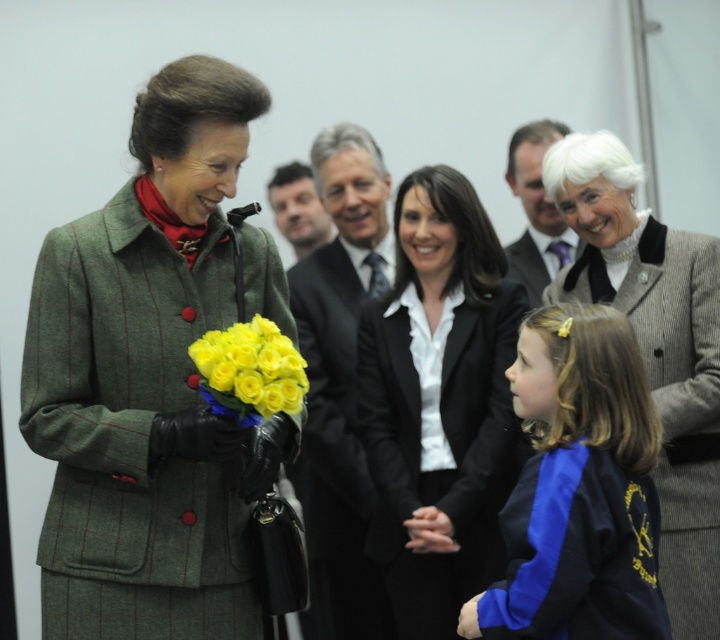
Between black satin blazer at center and dark gray wool business suit at upper center, which one has less height?

dark gray wool business suit at upper center

Does black satin blazer at center have a larger size compared to dark gray wool business suit at upper center?

Yes, black satin blazer at center is bigger than dark gray wool business suit at upper center.

Does point (390, 564) come closer to viewer compared to point (505, 252)?

That is True.

Identify the location of black satin blazer at center. (438, 403).

Does blue fabric jacket at lower right appear on the right side of gray suit at upper right?

In fact, blue fabric jacket at lower right is to the left of gray suit at upper right.

Is blue fabric jacket at lower right bigger than gray suit at upper right?

No.

Who is more forward, (626, 337) or (531, 192)?

Point (626, 337)

You are a GUI agent. You are given a task and a screenshot of the screen. Output one action in this format:
    pyautogui.click(x=<x>, y=<y>)
    Task: Click on the blue fabric jacket at lower right
    Image resolution: width=720 pixels, height=640 pixels.
    Given the screenshot: What is the action you would take?
    pos(580,486)

Can you confirm if black satin blazer at center is positioned to the left of black suit at center?

Incorrect, black satin blazer at center is not on the left side of black suit at center.

Can you confirm if black satin blazer at center is smaller than black suit at center?

Correct, black satin blazer at center occupies less space than black suit at center.

Where is `black satin blazer at center`? black satin blazer at center is located at coordinates (438, 403).